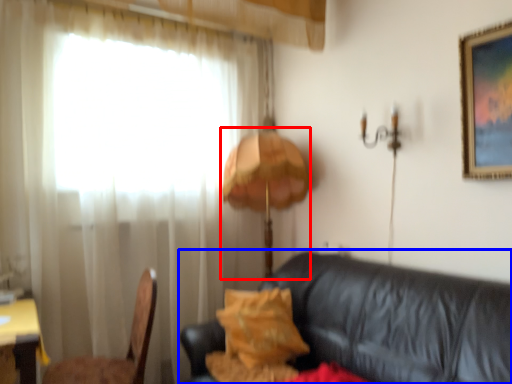
Question: Which object appears closest to the camera in this image, table lamp (highlighted by a red box) or studio couch (highlighted by a blue box)?

Choices:
 (A) table lamp
 (B) studio couch

Answer: (B)